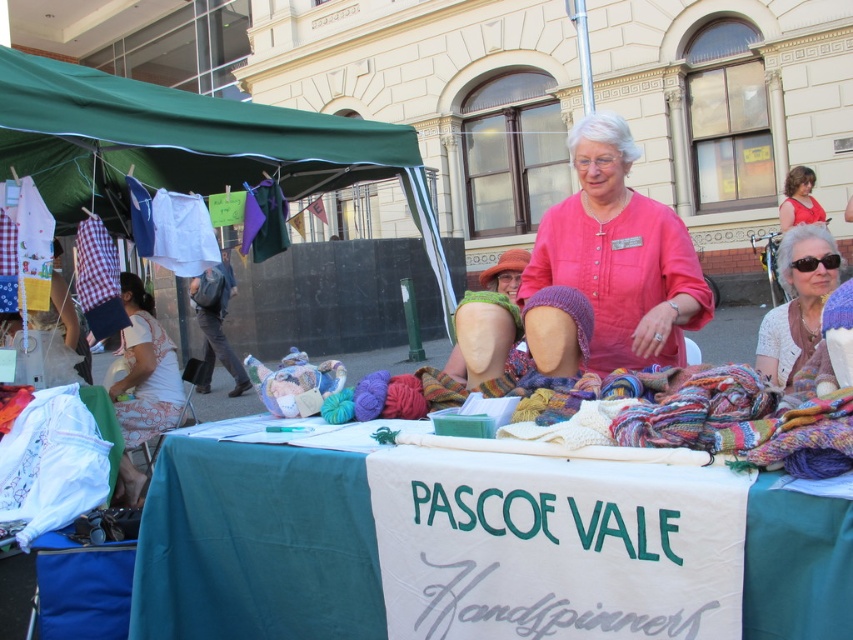
You are at the outdoor market and need to place a 10 feet long banner between the green fabric canopy at upper left and the sunglasses fabric at upper right. Can you fit it there?

The distance between the green fabric canopy at upper left and the sunglasses fabric at upper right is 10.19 feet, so yes, the banner can fit as it is slightly longer than the required space.

You are a visitor at the Pascoe Vale Handspinners market stall. You see two points marked on the table. The first point is at coordinate point(x=129, y=403) and the second is at point(x=207, y=362). If you are standing directly in front of the table, which point would be closer to you?

Point(x=129, y=403) is in front of point(x=207, y=362), so it would be closer to you when standing directly in front of the table.